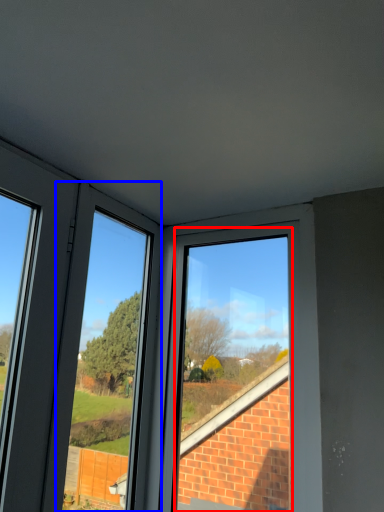
Question: Which point is further to the camera, bay window (highlighted by a red box) or window frame (highlighted by a blue box)?

Choices:
 (A) bay window
 (B) window frame

Answer: (A)